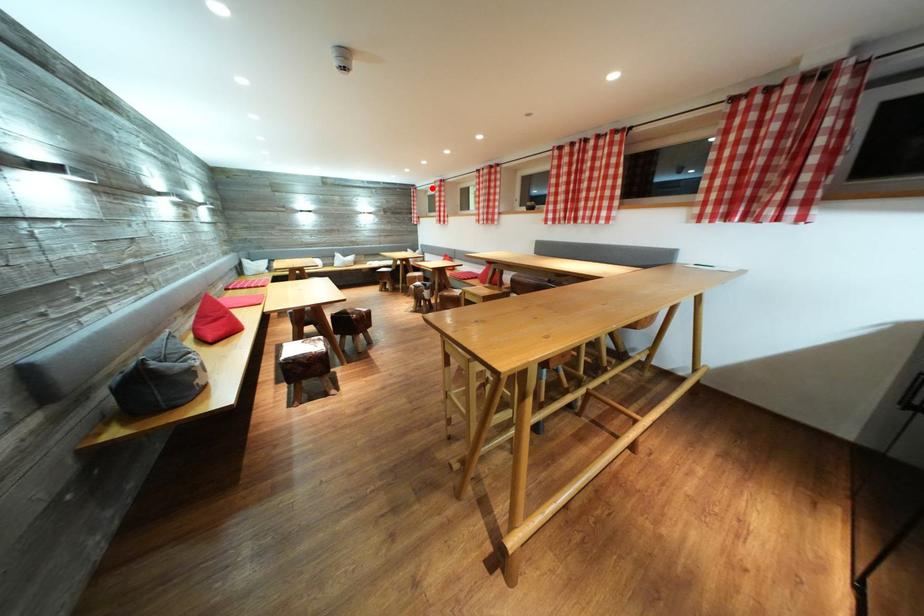
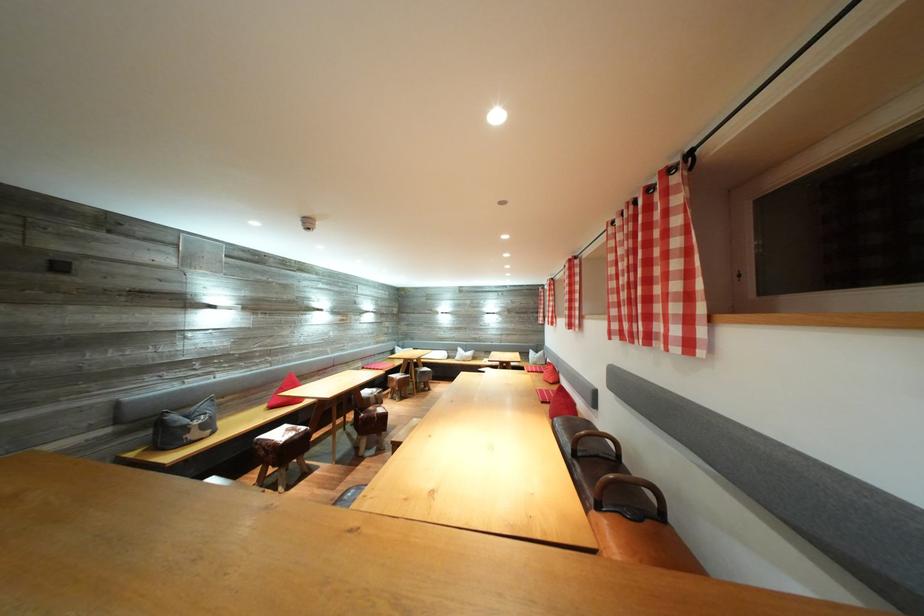
Question: I am providing you with two images of the same scene from different viewpoints. Given a red point in image1, look at the same physical point in image2. Is it:

Choices:
 (A) Closer to the viewpoint
 (B) Farther from the viewpoint

Answer: (B)